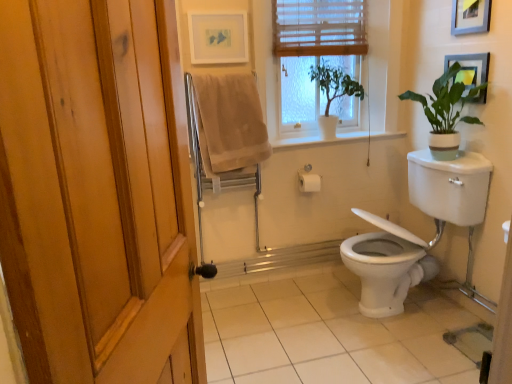
Locate an element on the screen. This screenshot has width=512, height=384. unoccupied area in front of white glossy toilet at lower right is located at coordinates (401, 357).